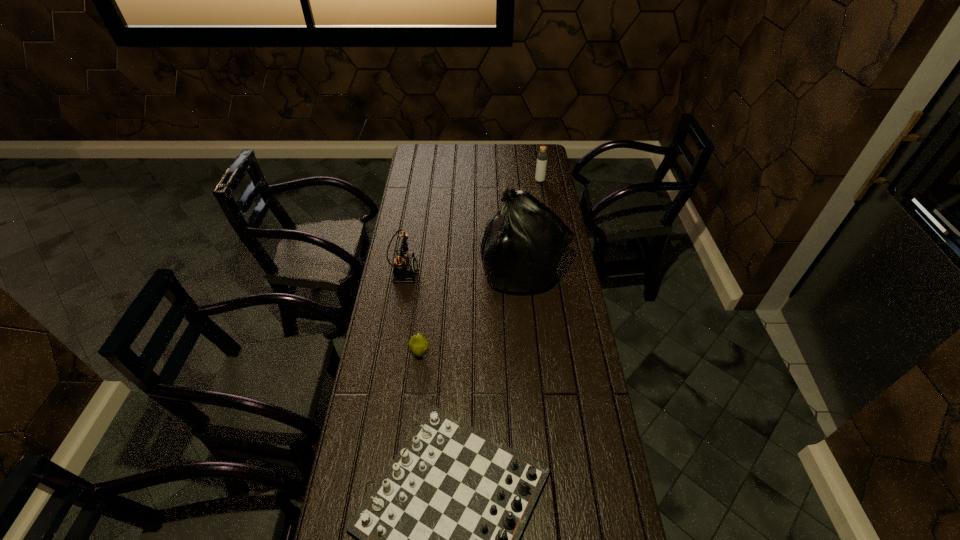
Identify the location of vacant space that is in between the bottle and the third shortest object. (471, 226).

This screenshot has width=960, height=540. What are the coordinates of `vacant area between the fourth farthest object and the bottle` in the screenshot? It's located at (480, 267).

Locate an element on the screen. blank region between the third tallest object and the pear is located at coordinates (411, 312).

Where is `the second closest object relative to the pear`? the second closest object relative to the pear is located at coordinates (405, 267).

Locate an element on the screen. Image resolution: width=960 pixels, height=540 pixels. the closest object relative to the chessboard is located at coordinates (418, 345).

Locate an element on the screen. This screenshot has height=540, width=960. vacant area in the image that satisfies the following two spatial constraints: 1. on the front of the pear at the rotary dial; 2. on the left side of the telephone is located at coordinates (389, 353).

I want to click on vacant region that satisfies the following two spatial constraints: 1. on the back side of the tallest object; 2. on the right side of the pear, so click(x=429, y=269).